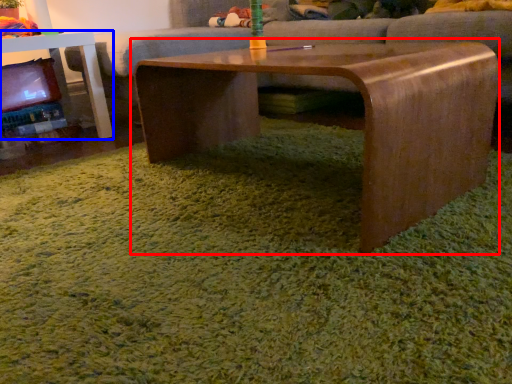
Question: Which point is further to the camera, coffee table (highlighted by a red box) or table (highlighted by a blue box)?

Choices:
 (A) coffee table
 (B) table

Answer: (B)